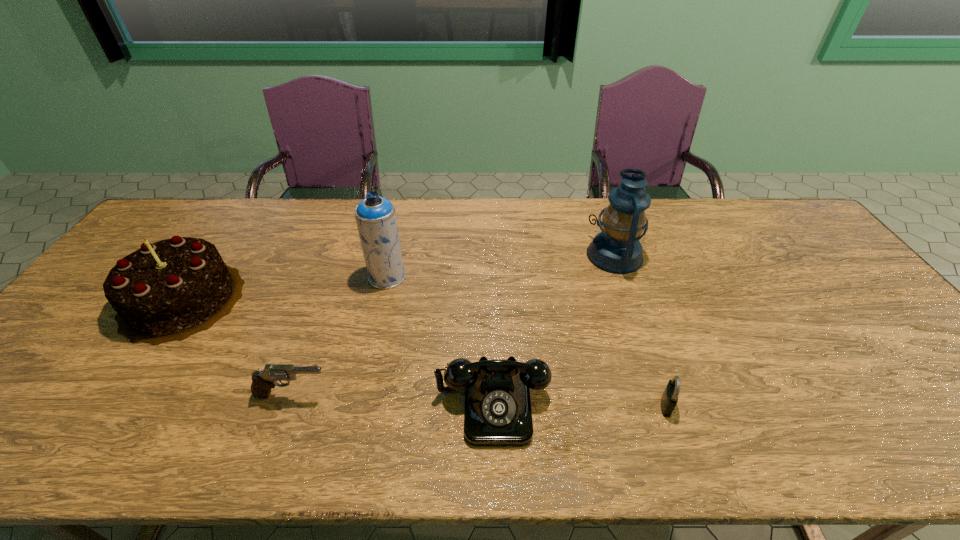
The height and width of the screenshot is (540, 960). Find the location of `vacant space located 0.100m on the front of the aerosol can`. vacant space located 0.100m on the front of the aerosol can is located at coordinates (378, 315).

This screenshot has width=960, height=540. Find the location of `free spot located on the front of the third tallest object`. free spot located on the front of the third tallest object is located at coordinates (139, 362).

You are a GUI agent. You are given a task and a screenshot of the screen. Output one action in this format:
    pyautogui.click(x=<x>, y=<y>)
    Task: Click on the free region located 0.300m at the barrel of the pistol
    The height and width of the screenshot is (540, 960).
    Given the screenshot: What is the action you would take?
    pyautogui.click(x=461, y=395)

Locate an element on the screen. This screenshot has height=540, width=960. vacant space located on the left of the shortest object is located at coordinates (575, 405).

Where is `object present at the far edge`? This screenshot has height=540, width=960. object present at the far edge is located at coordinates (617, 249).

Identify the location of object at the near edge. (498, 412).

You are a GUI agent. You are given a task and a screenshot of the screen. Output one action in this format:
    pyautogui.click(x=<x>, y=<y>)
    Task: Click on the object situated at the left edge
    The image size is (960, 540).
    Given the screenshot: What is the action you would take?
    pyautogui.click(x=166, y=291)

The width and height of the screenshot is (960, 540). I want to click on free region at the far edge, so coord(263,211).

At what (x,y) coordinates should I click in order to perform the action: click on free space at the near edge. Please return your answer as a coordinate pair (x, y). Looking at the image, I should click on (868, 453).

In the image, there is a desktop. Where is `free space at the left edge`? free space at the left edge is located at coordinates pyautogui.click(x=13, y=415).